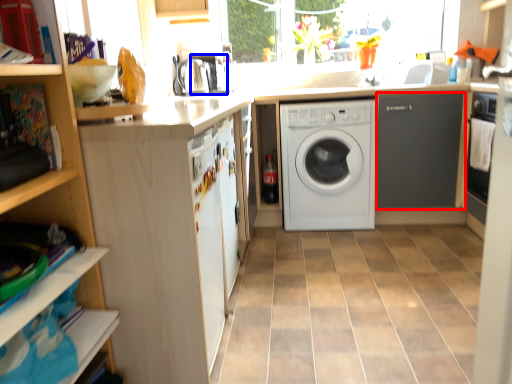
Question: Among these objects, which one is farthest to the camera, cabinetry (highlighted by a red box) or coffee machine (highlighted by a blue box)?

Choices:
 (A) cabinetry
 (B) coffee machine

Answer: (B)